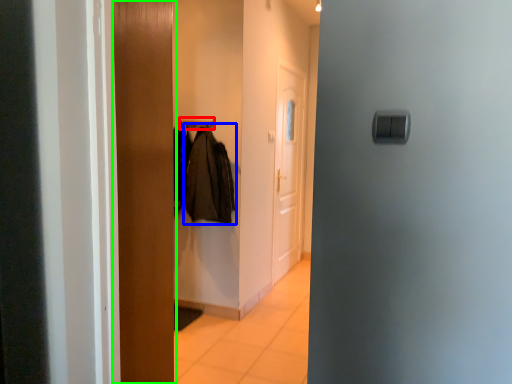
Question: Which object is positioned farthest from hanger (highlighted by a red box)? Select from clothing (highlighted by a blue box) and door (highlighted by a green box).

Choices:
 (A) clothing
 (B) door

Answer: (B)